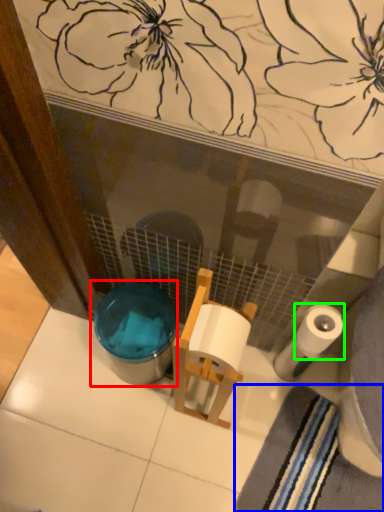
Question: Estimate the real-world distances between objects in this image. Which object is farther from potty (highlighted by a red box), bath towel (highlighted by a blue box) or toilet paper (highlighted by a green box)?

Choices:
 (A) bath towel
 (B) toilet paper

Answer: (A)